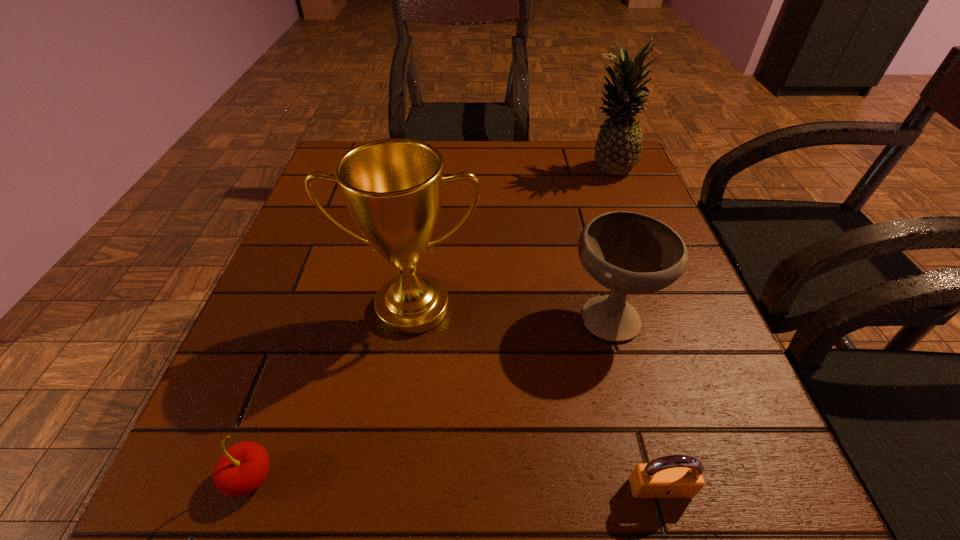
I want to click on the farthest object, so click(x=618, y=147).

Find the location of a particular element. This screenshot has height=540, width=960. award is located at coordinates (392, 187).

Where is `the third tallest object`? This screenshot has width=960, height=540. the third tallest object is located at coordinates (629, 253).

You are a GUI agent. You are given a task and a screenshot of the screen. Output one action in this format:
    pyautogui.click(x=<x>, y=<y>)
    Task: Click on the fourth tallest object
    
    Given the screenshot: What is the action you would take?
    click(x=242, y=469)

At what (x,y) coordinates should I click in order to perform the action: click on cherry. Please return your answer as a coordinate pair (x, y). The width and height of the screenshot is (960, 540). Looking at the image, I should click on (242, 469).

At what (x,y) coordinates should I click in order to perform the action: click on the shortest object. Please return your answer as a coordinate pair (x, y). Looking at the image, I should click on (674, 476).

The height and width of the screenshot is (540, 960). Identify the location of vacant space located 0.370m on the front of the farthest object. (654, 289).

The width and height of the screenshot is (960, 540). What are the coordinates of `free space located by the handles of the second object from left to right` in the screenshot? It's located at 403,370.

You are a GUI agent. You are given a task and a screenshot of the screen. Output one action in this format:
    pyautogui.click(x=<x>, y=<y>)
    Task: Click on the free spot located 0.230m on the back of the third shortest object
    
    Given the screenshot: What is the action you would take?
    pyautogui.click(x=583, y=211)

Where is `free space located on the left of the second shortest object`? free space located on the left of the second shortest object is located at coordinates (181, 477).